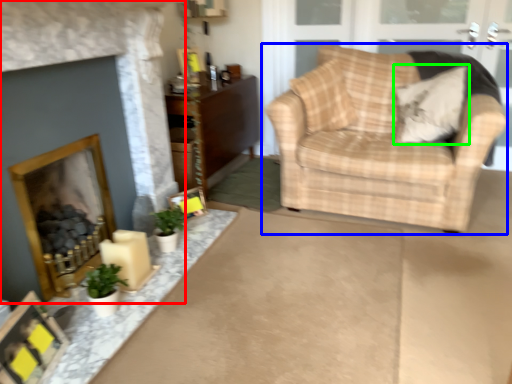
Question: Estimate the real-world distances between objects in this image. Which object is farther from fireplace (highlighted by a red box), chair (highlighted by a blue box) or pillow (highlighted by a green box)?

Choices:
 (A) chair
 (B) pillow

Answer: (B)